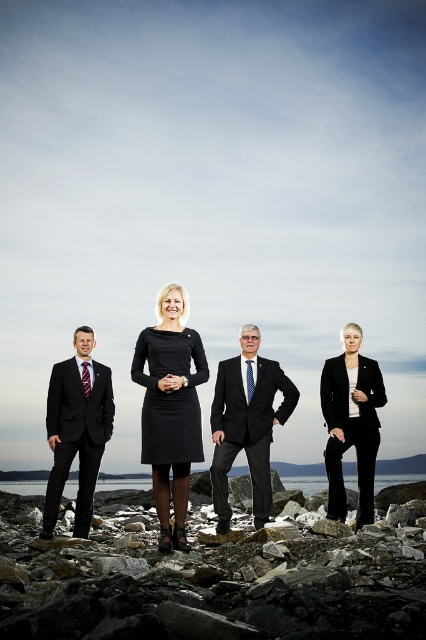
Question: Can you confirm if black matte suit at center is positioned to the right of transparent water at center?

Choices:
 (A) no
 (B) yes

Answer: (A)

Question: Can you confirm if black matte suit at center is thinner than black matte blazer at right?

Choices:
 (A) no
 (B) yes

Answer: (B)

Question: Can you confirm if rough stone at center is bigger than matte black suit at left?

Choices:
 (A) yes
 (B) no

Answer: (A)

Question: Which point is closer to the camera?

Choices:
 (A) black matte suit at center
 (B) black matte blazer at right
 (C) transparent water at center
 (D) matte black suit at left

Answer: (A)

Question: Among these points, which one is nearest to the camera?

Choices:
 (A) (249, 456)
 (B) (152, 420)
 (C) (71, 483)
 (D) (147, 340)

Answer: (B)

Question: Estimate the real-world distances between objects in this image. Which object is farther from the transparent water at center?

Choices:
 (A) matte black suit at center
 (B) rough stone at center
 (C) black matte blazer at right
 (D) black matte dress at center

Answer: (D)